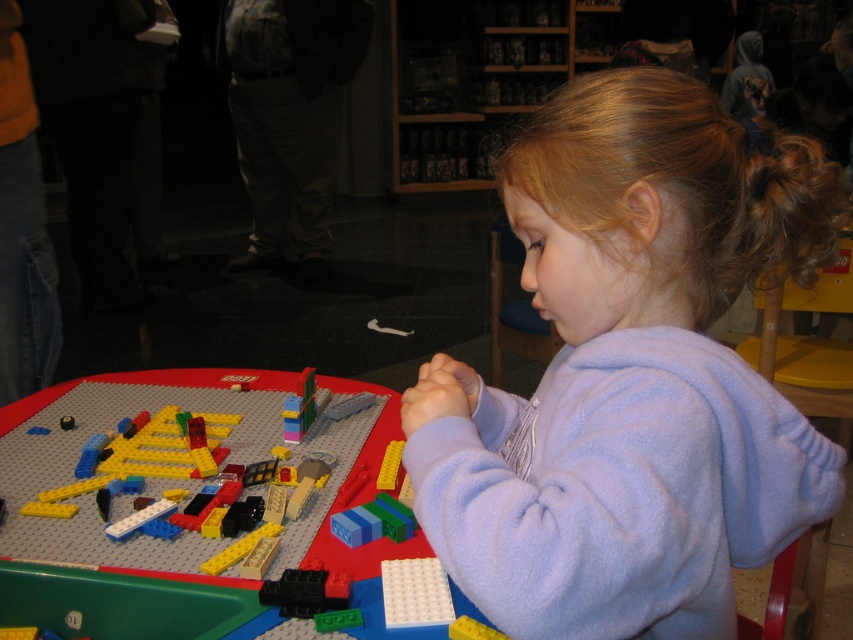
Is white plastic plate at lower center bigger than yellow matte brick at center?

Indeed, white plastic plate at lower center has a larger size compared to yellow matte brick at center.

Is white plastic plate at lower center taller than yellow matte brick at center?

Incorrect, white plastic plate at lower center's height is not larger of yellow matte brick at center's.

Who is more distant from viewer, (445, 595) or (395, 483)?

The point (395, 483) is behind.

Locate an element on the screen. This screenshot has height=640, width=853. white plastic plate at lower center is located at coordinates (415, 593).

Can you confirm if plastic lego table at center is positioned below yellow matte brick at center?

Yes, plastic lego table at center is below yellow matte brick at center.

Does point (74, 515) come in front of point (393, 468)?

That is True.

Image resolution: width=853 pixels, height=640 pixels. Identify the location of plastic lego table at center. (126, 540).

Is purple fleece at center shorter than plastic lego table at center?

In fact, purple fleece at center may be taller than plastic lego table at center.

Is purple fleece at center further to camera compared to plastic lego table at center?

That is False.

Between point (640, 248) and point (292, 556), which one is positioned behind?

Positioned behind is point (292, 556).

Where is `purple fleece at center`? Image resolution: width=853 pixels, height=640 pixels. purple fleece at center is located at coordinates (630, 374).